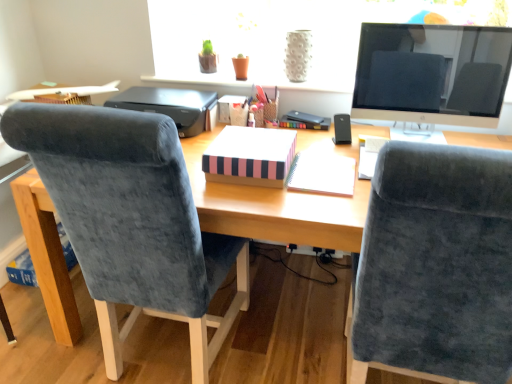
In order to click on free point above white spiral notebook at center, which ranks as the first notebook in right-to-left order (from a real-world perspective) in this screenshot , I will do `click(324, 167)`.